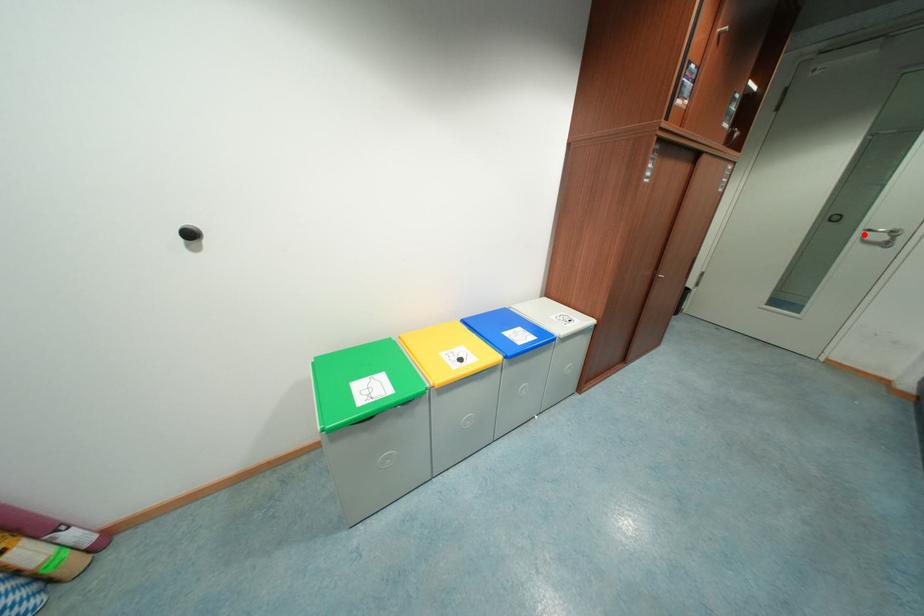
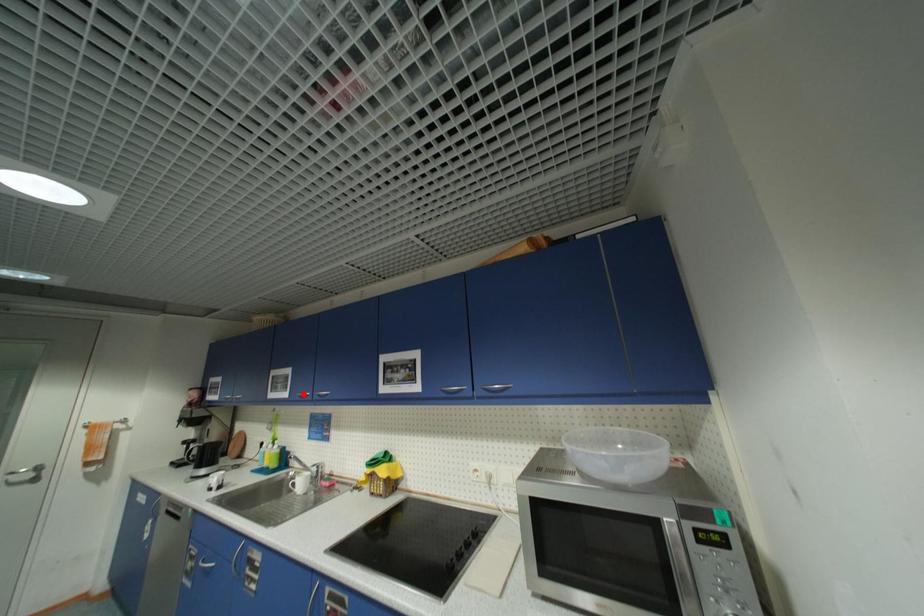
I am providing you with two images of the same scene from different viewpoints. A red point is marked on the first image and another point is marked on the second image. Do the highlighted points in image1 and image2 indicate the same real-world spot?

No